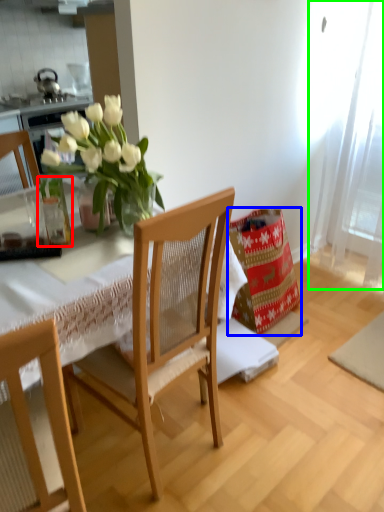
Question: Considering the real-world distances, which object is closest to glass vase (highlighted by a red box)? material (highlighted by a blue box) or curtain (highlighted by a green box).

Choices:
 (A) material
 (B) curtain

Answer: (A)